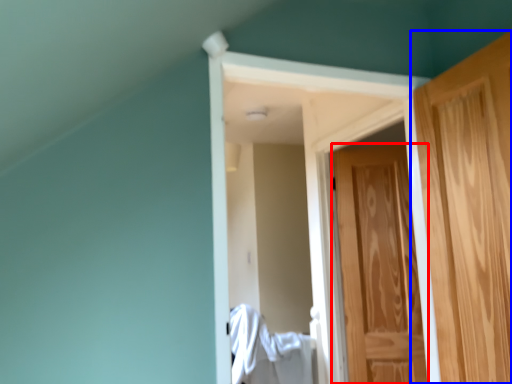
Question: Which object appears farthest to the camera in this image, door (highlighted by a red box) or door (highlighted by a blue box)?

Choices:
 (A) door
 (B) door

Answer: (A)